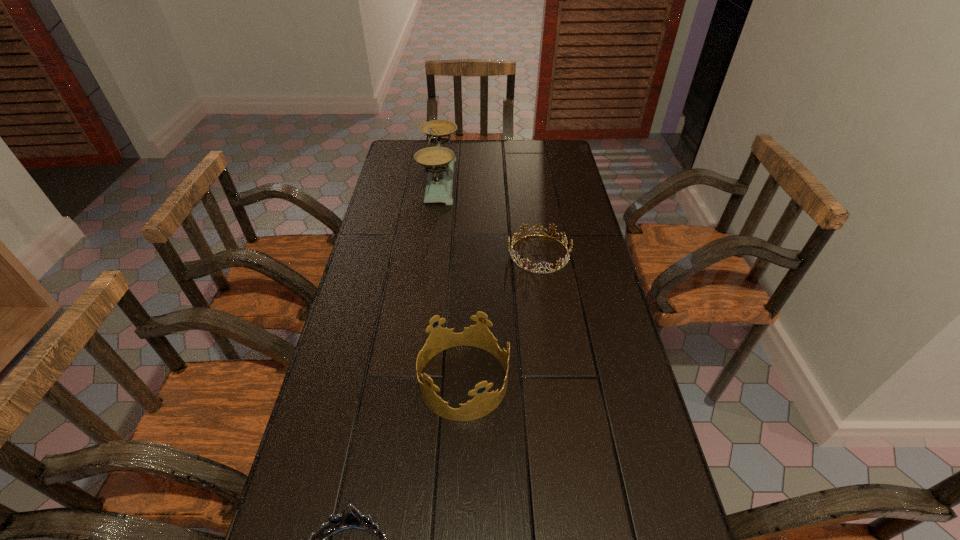
The image size is (960, 540). What are the coordinates of `vacant space located on the front-facing side of the rightmost tiara` in the screenshot? It's located at (438, 254).

Locate an element on the screen. Image resolution: width=960 pixels, height=540 pixels. object that is positioned at the far edge is located at coordinates (438, 161).

Image resolution: width=960 pixels, height=540 pixels. In order to click on object positioned at the left edge in this screenshot , I will do `click(438, 161)`.

Where is `object that is positioned at the right edge`? The width and height of the screenshot is (960, 540). object that is positioned at the right edge is located at coordinates (514, 237).

Find the location of a particular element. The width and height of the screenshot is (960, 540). object that is positioned at the far left corner is located at coordinates (438, 161).

I want to click on free space at the left edge of the desktop, so (x=296, y=508).

Image resolution: width=960 pixels, height=540 pixels. I want to click on vacant space at the right edge, so click(x=558, y=202).

At what (x,y) coordinates should I click in order to perform the action: click on vacant region at the far right corner of the desktop. Please return your answer as a coordinate pair (x, y). This screenshot has height=540, width=960. Looking at the image, I should click on (542, 146).

Find the location of `free point between the scale and the second tallest object`. free point between the scale and the second tallest object is located at coordinates (451, 280).

Where is `vacant area between the tallest object and the third shortest object`? This screenshot has width=960, height=540. vacant area between the tallest object and the third shortest object is located at coordinates click(451, 280).